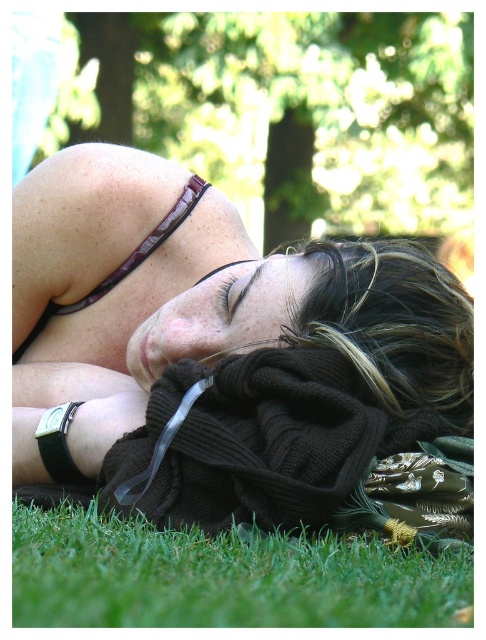
Question: From the image, what is the correct spatial relationship of matte black sweater at center in relation to dark brown knit sweater at center?

Choices:
 (A) below
 (B) above

Answer: (A)

Question: Is green soft grass at lower left below dark brown knit sweater at center?

Choices:
 (A) yes
 (B) no

Answer: (A)

Question: Considering the real-world distances, which object is farthest from the dark brown knit sweater at center?

Choices:
 (A) green soft grass at lower left
 (B) matte black sweater at center

Answer: (A)

Question: Which point is closer to the camera?

Choices:
 (A) (70, 512)
 (B) (316, 284)
 (C) (378, 257)

Answer: (A)

Question: Is matte black sweater at center bigger than green soft grass at lower left?

Choices:
 (A) no
 (B) yes

Answer: (B)

Question: Which point is farther from the camera taking this photo?

Choices:
 (A) (22, 328)
 (B) (79, 579)
 (C) (319, 285)

Answer: (A)